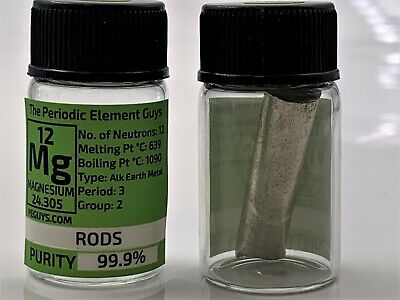
The image size is (400, 300). I want to click on sticker, so click(x=30, y=111), click(x=218, y=121).